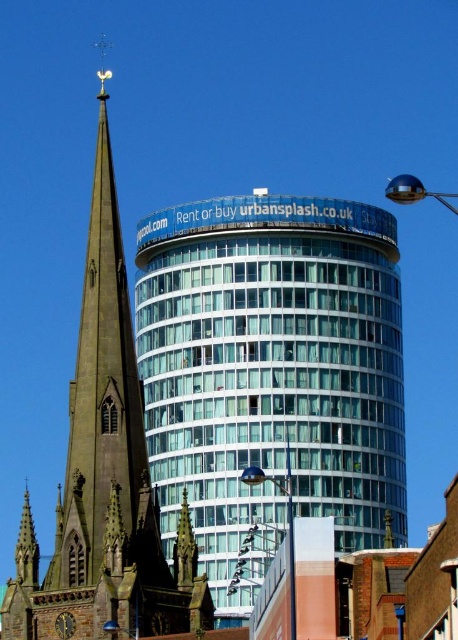
Between point (91, 515) and point (75, 625), which one is positioned in front?

Point (75, 625)

Which of these two, smooth stone spire at left or dark brown wooden clock at center-left, stands taller?

smooth stone spire at left is taller.

Describe the element at coordinates (105, 476) in the screenshot. This screenshot has height=640, width=458. I see `smooth stone spire at left` at that location.

Locate an element on the screen. This screenshot has height=640, width=458. smooth stone spire at left is located at coordinates (105, 476).

Does clear glass building at center come behind dark brown wooden clock at center-left?

Yes, it is.

Between point (397, 326) and point (61, 625), which one is positioned behind?

The point (397, 326) is more distant.

You are a GUI agent. You are given a task and a screenshot of the screen. Output one action in this format:
    pyautogui.click(x=<x>, y=<y>)
    Task: Click on the clear glass building at center
    Image resolution: width=458 pixels, height=640 pixels.
    Given the screenshot: What is the action you would take?
    pyautogui.click(x=271, y=374)

Between point (376, 216) and point (80, 442), which one is positioned behind?

The point (376, 216) is behind.

Can you confirm if clear glass building at center is thinner than smooth stone spire at left?

Indeed, clear glass building at center has a lesser width compared to smooth stone spire at left.

Identify the location of clear glass building at center. This screenshot has width=458, height=640. pos(271,374).